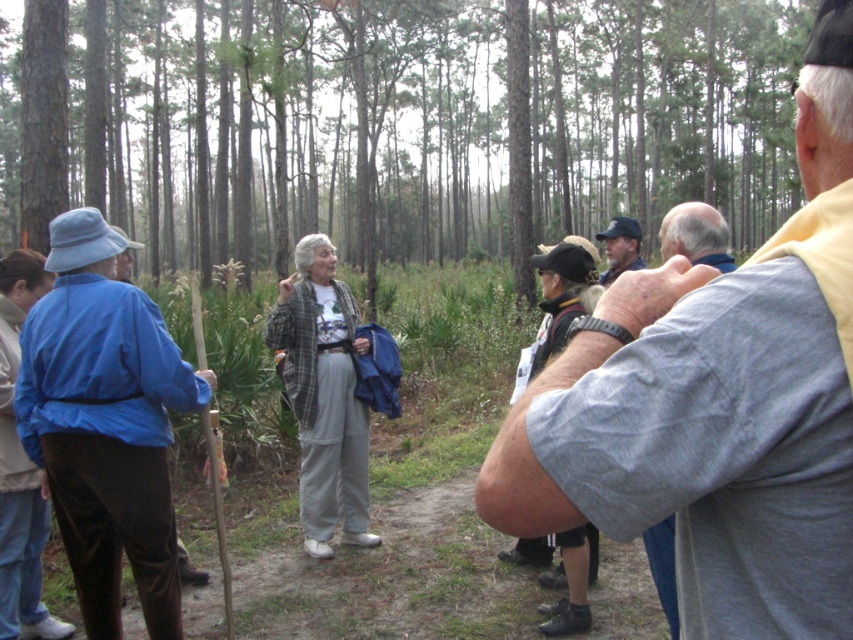
Question: Among these objects, which one is farthest from the camera?

Choices:
 (A) matte blue cap at center
 (B) blue fabric jacket at left

Answer: (A)

Question: Can you confirm if smooth bark tree at center is positioned to the left of matte blue cap at center?

Choices:
 (A) no
 (B) yes

Answer: (A)

Question: Does smooth bark tree at center appear on the left side of plaid fabric jacket at center?

Choices:
 (A) yes
 (B) no

Answer: (B)

Question: Is smooth bark tree at center positioned before matte blue cap at center?

Choices:
 (A) no
 (B) yes

Answer: (A)

Question: Estimate the real-world distances between objects in this image. Which object is closer to the plaid fabric jacket at center?

Choices:
 (A) gray fabric shirt at upper right
 (B) smooth bark tree at center
 (C) blue fabric jacket at left
 (D) matte blue cap at center

Answer: (C)

Question: Which point is farther to the camera?

Choices:
 (A) smooth bark tree at center
 (B) blue fabric jacket at left
 (C) matte blue cap at center
 (D) gray fabric shirt at upper right

Answer: (A)